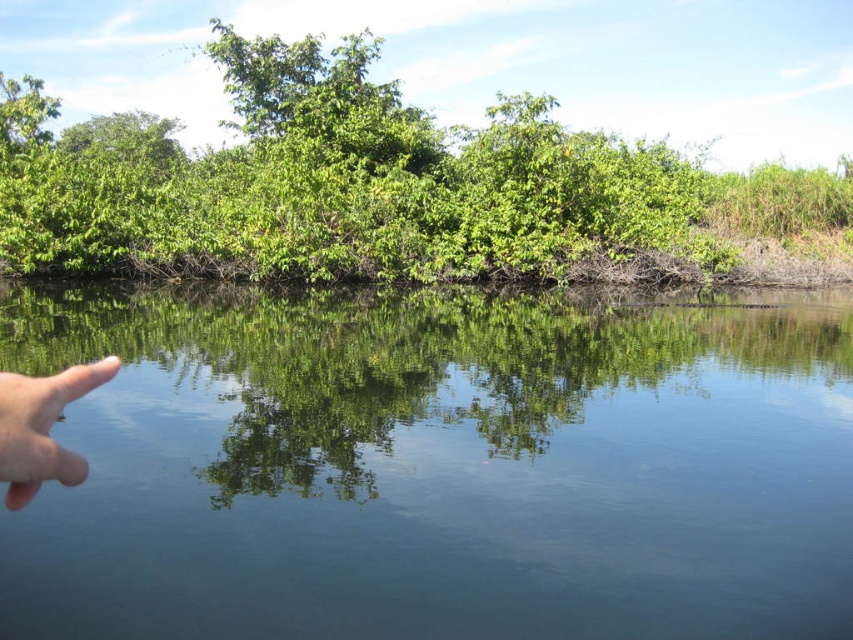
Does transparent water at center have a greater height compared to flesh-toned skin at left?

Yes.

Consider the image. Does transparent water at center have a smaller size compared to flesh-toned skin at left?

No.

Where is `transparent water at center`? This screenshot has height=640, width=853. transparent water at center is located at coordinates (436, 467).

Who is more forward, (88, 308) or (280, 115)?

Positioned in front is point (88, 308).

Does transparent water at center come in front of green leafy bush at upper center?

Yes, it is in front of green leafy bush at upper center.

Which is in front, point (312, 426) or point (477, 202)?

Point (312, 426)

Locate an element on the screen. This screenshot has height=640, width=853. transparent water at center is located at coordinates pos(436,467).

Does point (451, 253) come closer to viewer compared to point (28, 433)?

No, it is not.

The width and height of the screenshot is (853, 640). What are the coordinates of `green leafy bush at upper center` in the screenshot? It's located at (373, 186).